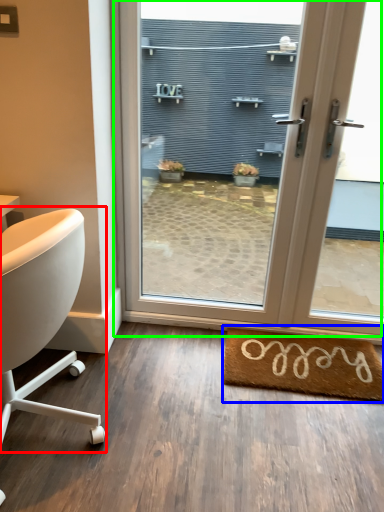
Question: Which object is positioned closest to chair (highlighted by a red box)? Select from mat (highlighted by a blue box) and door (highlighted by a green box).

Choices:
 (A) mat
 (B) door

Answer: (B)